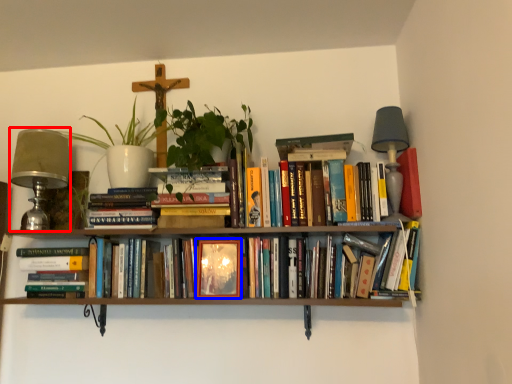
Question: Among these objects, which one is farthest to the camera, table lamp (highlighted by a red box) or paperback book (highlighted by a blue box)?

Choices:
 (A) table lamp
 (B) paperback book

Answer: (A)